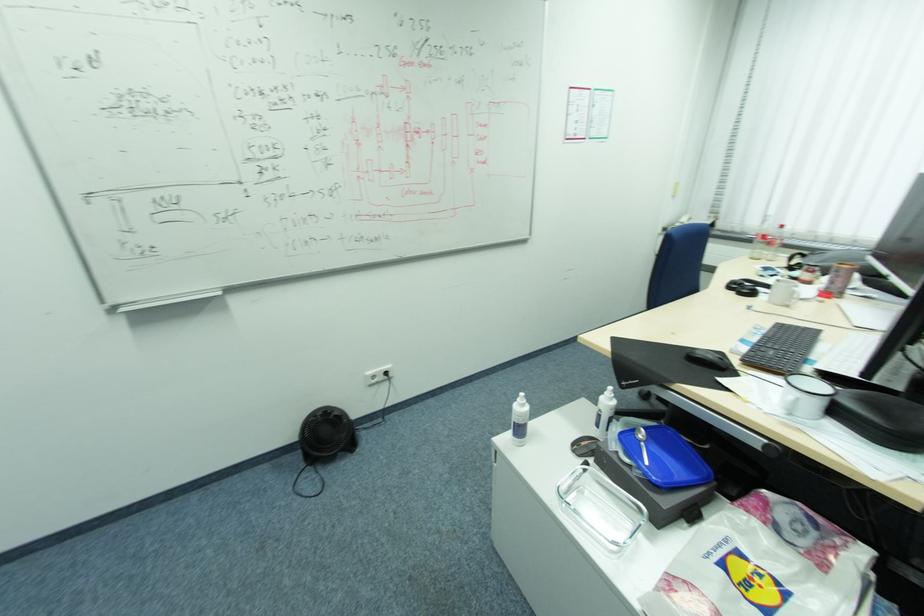
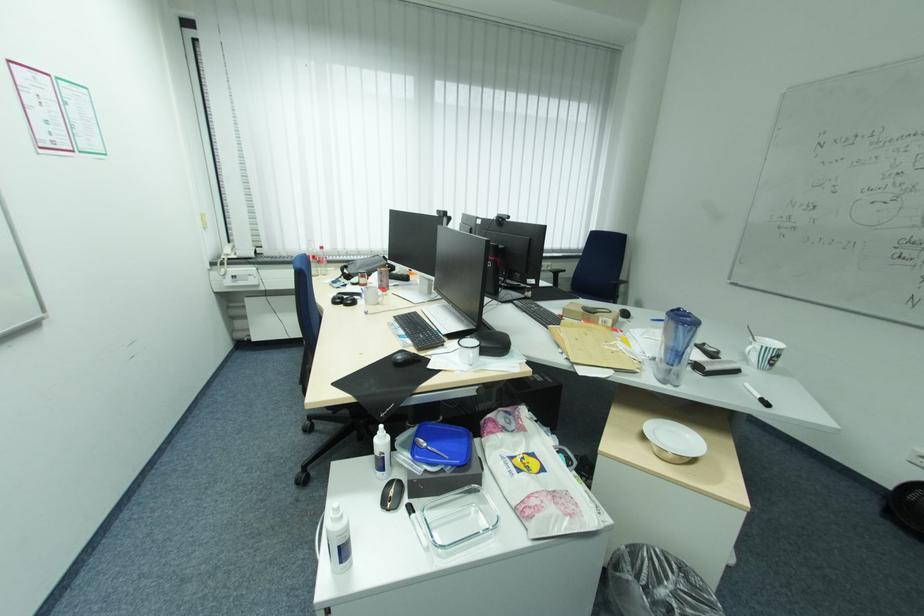
Where in the second image is the point corresponding to the point at 526,430 from the first image?

(350, 549)